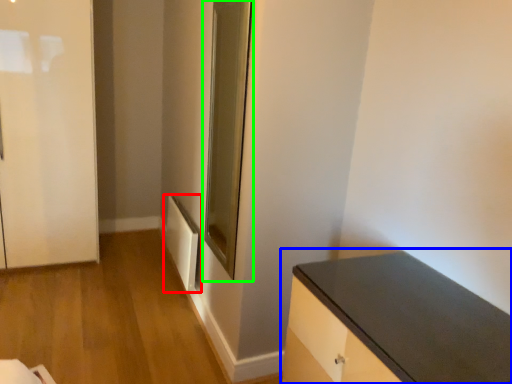
Question: Considering the real-world distances, which object is closest to radiator (highlighted by a red box)? countertop (highlighted by a blue box) or glass door (highlighted by a green box).

Choices:
 (A) countertop
 (B) glass door

Answer: (B)